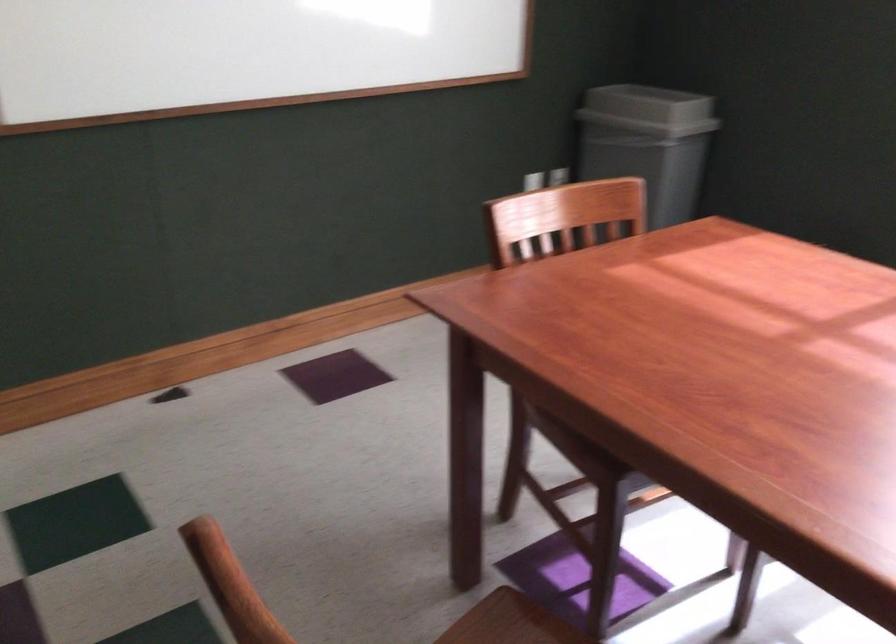
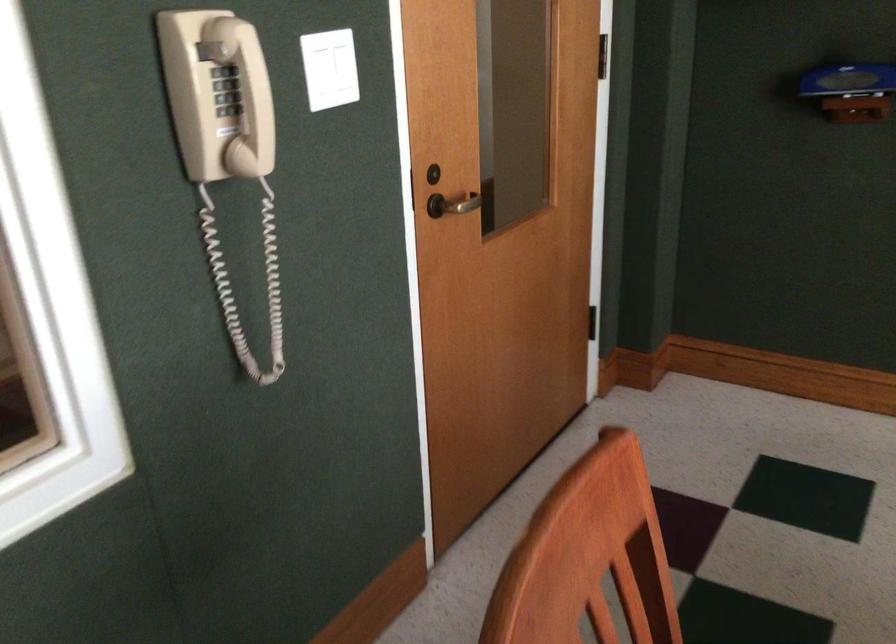
Question: The camera is either moving clockwise (left) or counter-clockwise (right) around the object. The first image is from the beginning of the video and the second image is from the end. Is the camera moving left or right when shooting the video?

Choices:
 (A) Left
 (B) Right

Answer: (B)